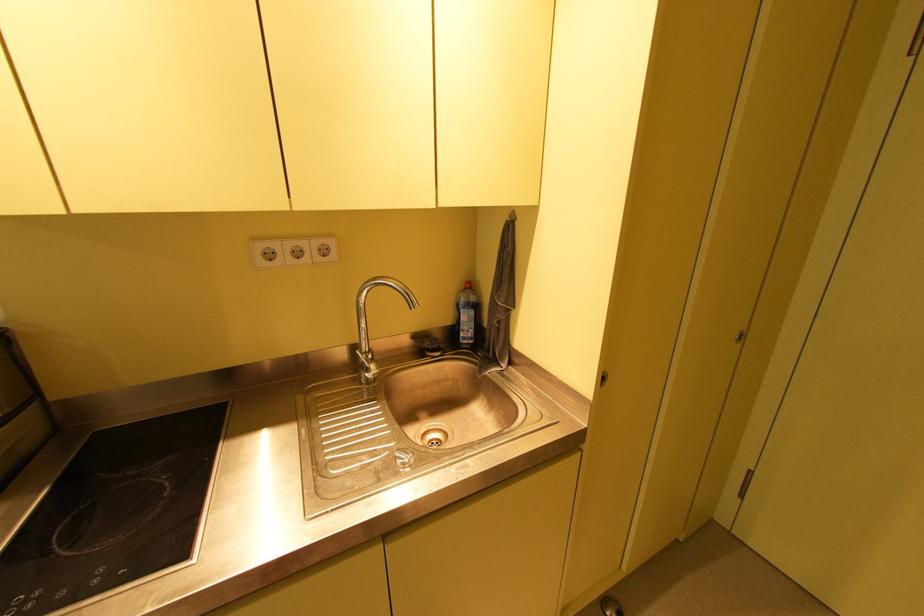
Where is `faucet handle`? The image size is (924, 616). faucet handle is located at coordinates (367, 366).